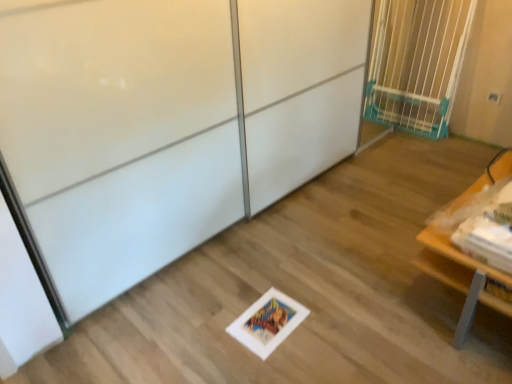
Question: Considering the relative positions of white glossy screen door at center and wooden table at lower right in the image provided, is white glossy screen door at center to the right of wooden table at lower right from the viewer's perspective?

Choices:
 (A) yes
 (B) no

Answer: (B)

Question: Is white glossy screen door at center closer to camera compared to wooden table at lower right?

Choices:
 (A) yes
 (B) no

Answer: (A)

Question: Is the position of white glossy screen door at center more distant than that of wooden table at lower right?

Choices:
 (A) yes
 (B) no

Answer: (B)

Question: Is white glossy screen door at center positioned with its back to wooden table at lower right?

Choices:
 (A) no
 (B) yes

Answer: (A)

Question: Is white glossy screen door at center completely or partially outside of wooden table at lower right?

Choices:
 (A) no
 (B) yes

Answer: (B)

Question: From a real-world perspective, is blue plastic gate at upper right above or below white glossy screen door at center?

Choices:
 (A) below
 (B) above

Answer: (A)

Question: Is blue plastic gate at upper right inside or outside of white glossy screen door at center?

Choices:
 (A) outside
 (B) inside

Answer: (B)

Question: Considering the positions of blue plastic gate at upper right and white glossy screen door at center in the image, is blue plastic gate at upper right bigger or smaller than white glossy screen door at center?

Choices:
 (A) small
 (B) big

Answer: (A)

Question: Is point (368, 117) closer or farther from the camera than point (118, 38)?

Choices:
 (A) closer
 (B) farther

Answer: (B)

Question: Considering the positions of white glossy screen door at center and wooden table at lower right in the image, is white glossy screen door at center bigger or smaller than wooden table at lower right?

Choices:
 (A) small
 (B) big

Answer: (B)

Question: From their relative heights in the image, would you say white glossy screen door at center is taller or shorter than wooden table at lower right?

Choices:
 (A) tall
 (B) short

Answer: (A)

Question: From the image's perspective, relative to wooden table at lower right, is white glossy screen door at center above or below?

Choices:
 (A) above
 (B) below

Answer: (A)

Question: Considering their positions, is white glossy screen door at center located in front of or behind wooden table at lower right?

Choices:
 (A) behind
 (B) front

Answer: (B)

Question: Considering their positions, is wooden table at lower right located in front of or behind white glossy screen door at center?

Choices:
 (A) front
 (B) behind

Answer: (B)

Question: Is point (473, 261) positioned closer to the camera than point (260, 72)?

Choices:
 (A) closer
 (B) farther

Answer: (A)